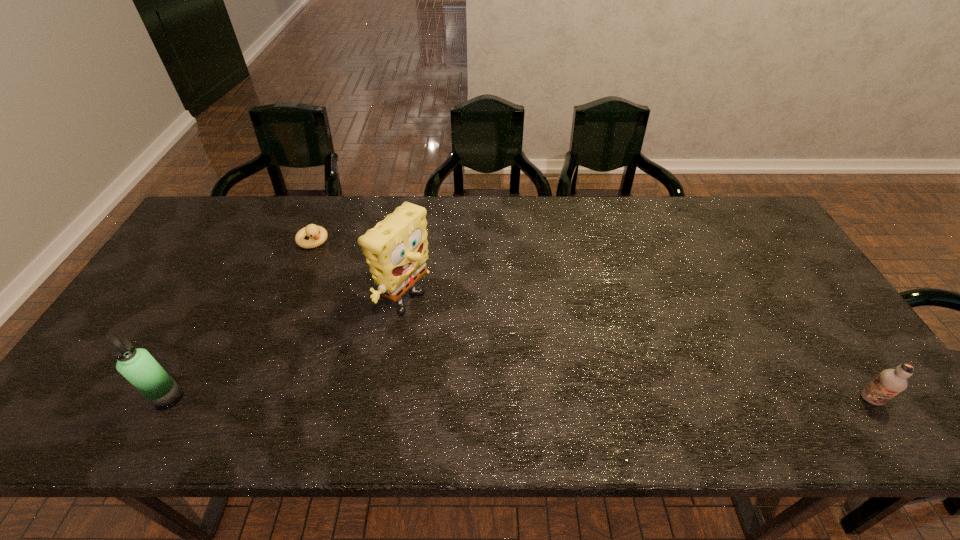
At what (x,y) coordinates should I click in order to perform the action: click on free space between the farthest object and the third nearest object. Please return your answer as a coordinate pair (x, y). Looking at the image, I should click on (359, 274).

This screenshot has width=960, height=540. I want to click on free space between the rightmost object and the third nearest object, so click(x=637, y=353).

The width and height of the screenshot is (960, 540). What are the coordinates of `empty location between the tallest object and the second object from left to right` in the screenshot? It's located at (359, 274).

You are a GUI agent. You are given a task and a screenshot of the screen. Output one action in this format:
    pyautogui.click(x=<x>, y=<y>)
    Task: Click on the free space between the leftmost object and the duckling
    The height and width of the screenshot is (540, 960).
    Given the screenshot: What is the action you would take?
    pyautogui.click(x=241, y=319)

This screenshot has height=540, width=960. Find the location of `free spot between the second shortest object and the leftmost object`. free spot between the second shortest object and the leftmost object is located at coordinates (519, 399).

The height and width of the screenshot is (540, 960). In order to click on free space between the thermos bottle and the chocolate milk in this screenshot , I will do `click(519, 399)`.

The image size is (960, 540). In order to click on empty space that is in between the thermos bottle and the chocolate milk in this screenshot , I will do `click(519, 399)`.

I want to click on object that stands as the third closest to the duckling, so click(x=890, y=382).

The width and height of the screenshot is (960, 540). Find the location of `object that stands as the third closest to the thermos bottle`. object that stands as the third closest to the thermos bottle is located at coordinates (890, 382).

I want to click on vacant position in the image that satisfies the following two spatial constraints: 1. on the front side of the second tallest object; 2. on the right side of the rightmost object, so click(x=168, y=400).